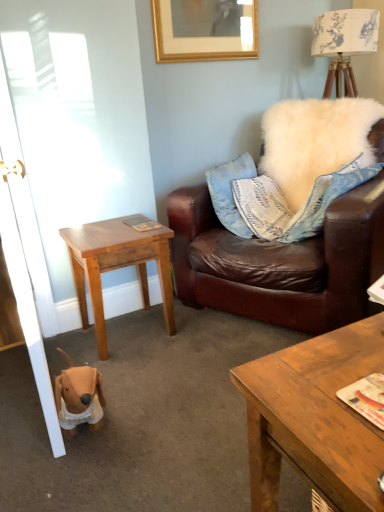
Locate an element on the screen. This screenshot has width=384, height=512. empty space that is to the right of light brown wooden table at lower left is located at coordinates (201, 330).